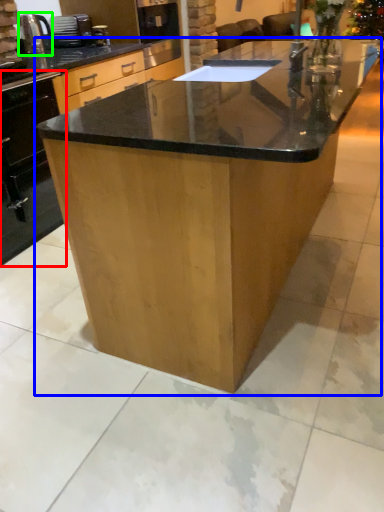
Question: Which is nearer to the oven (highlighted by a red box)? table (highlighted by a blue box) or kitchen appliance (highlighted by a green box).

Choices:
 (A) table
 (B) kitchen appliance

Answer: (B)